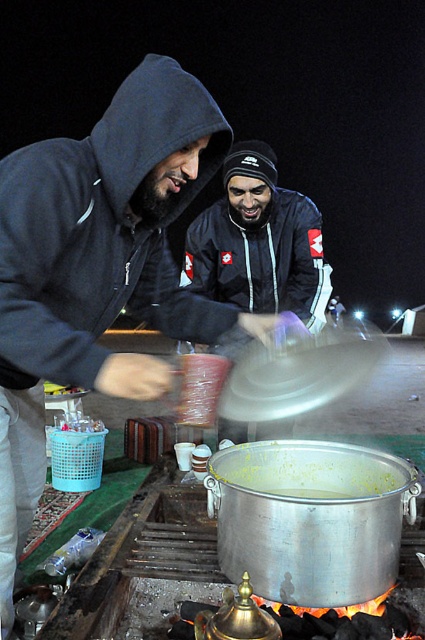
Question: Which point is farther from the camera taking this photo?

Choices:
 (A) (62, 305)
 (B) (286, 237)

Answer: (B)

Question: Is matte black hoodie at center smaller than black matte jacket at center?

Choices:
 (A) yes
 (B) no

Answer: (B)

Question: Does matte black hoodie at center lie in front of black matte jacket at center?

Choices:
 (A) yes
 (B) no

Answer: (A)

Question: Can you confirm if matte black hoodie at center is positioned to the right of black matte jacket at center?

Choices:
 (A) no
 (B) yes

Answer: (A)